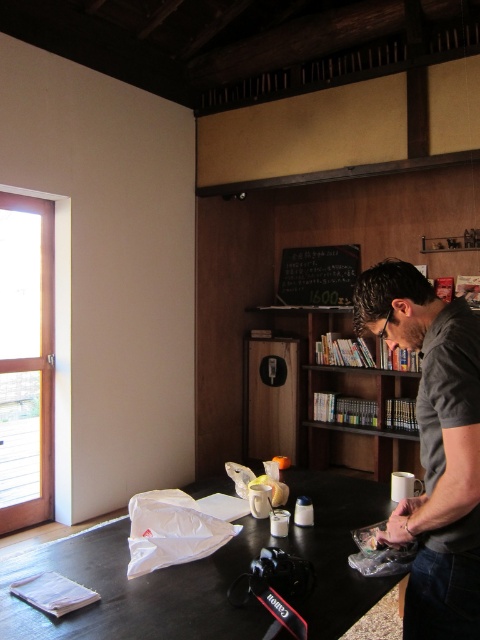
Does dark gray shirt at center have a smaller size compared to black chalkboard at upper center?

Yes, dark gray shirt at center is smaller than black chalkboard at upper center.

Does dark gray shirt at center appear on the left side of black chalkboard at upper center?

Yes, dark gray shirt at center is to the left of black chalkboard at upper center.

Is point (460, 436) closer to viewer compared to point (294, 276)?

Yes, it is in front of point (294, 276).

The height and width of the screenshot is (640, 480). In order to click on dark gray shirt at center in this screenshot , I will do pos(433,445).

Between wooden bookshelf at center and black chalkboard at upper center, which one is positioned higher?

black chalkboard at upper center is above.

Can you confirm if wooden bookshelf at center is wider than black chalkboard at upper center?

Yes, wooden bookshelf at center is wider than black chalkboard at upper center.

Who is more forward, (303, 310) or (294, 300)?

Point (303, 310) is in front.

Where is `wooden bookshelf at center`? wooden bookshelf at center is located at coordinates (348, 397).

Which of these two, dark gray shirt at center or wooden bookshelf at center, stands taller?

wooden bookshelf at center

Does dark gray shirt at center have a larger size compared to wooden bookshelf at center?

No.

This screenshot has width=480, height=640. What do you see at coordinates (433, 445) in the screenshot?
I see `dark gray shirt at center` at bounding box center [433, 445].

Find the location of a particular element. dark gray shirt at center is located at coordinates (433, 445).